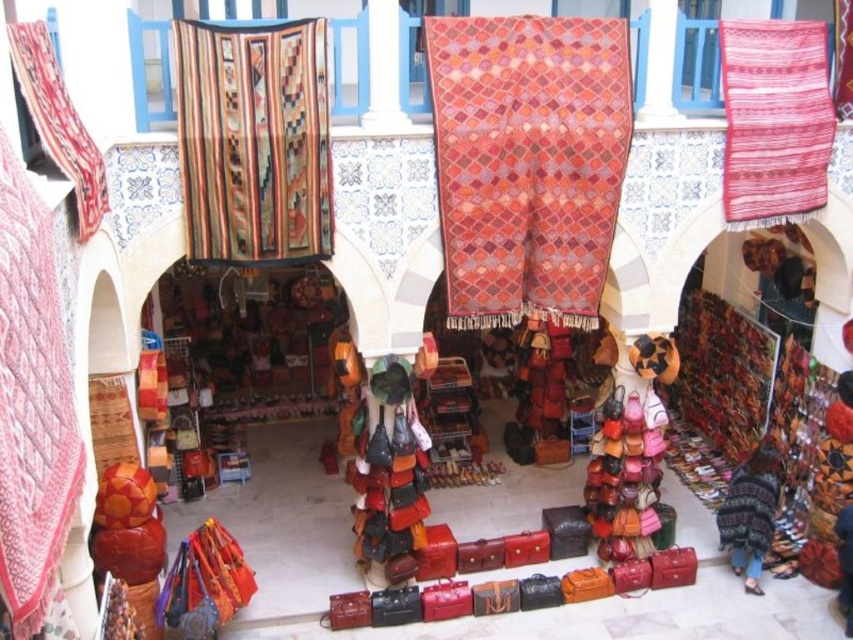
Is point (250, 230) behind point (28, 445)?

Yes, it is.

Does multicolored woven rug at upper left come in front of quilted pink fabric at left?

That is False.

You are a GUI agent. You are given a task and a screenshot of the screen. Output one action in this format:
    pyautogui.click(x=<x>, y=<y>)
    Task: Click on the multicolored woven rug at upper left
    This screenshot has height=640, width=853.
    Given the screenshot: What is the action you would take?
    pyautogui.click(x=254, y=140)

Is multicolored woven rug at upper left closer to the viewer compared to red woven rug at upper left?

No, it is not.

Can you confirm if multicolored woven rug at upper left is bigger than red woven rug at upper left?

Yes.

What do you see at coordinates (254, 140) in the screenshot? I see `multicolored woven rug at upper left` at bounding box center [254, 140].

Image resolution: width=853 pixels, height=640 pixels. I want to click on multicolored woven rug at upper left, so click(x=254, y=140).

Is quilted pink fabric at left wider than woven fabric rug at upper right?

No.

Is point (19, 256) less distant than point (817, 161)?

Yes.

Who is more distant from viewer, (39, 506) or (746, 152)?

Positioned behind is point (746, 152).

Find the location of a particular element. quilted pink fabric at left is located at coordinates (32, 403).